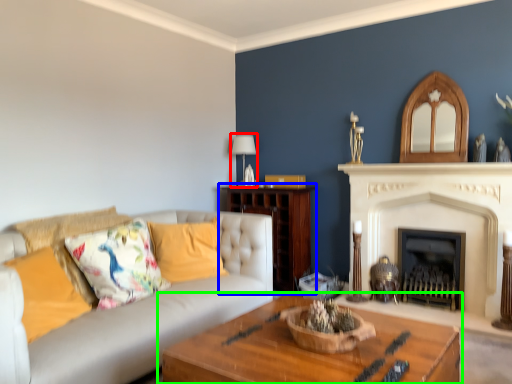
Question: Which is nearer to the lamp (highlighted by a red box)? hardwood (highlighted by a blue box) or table (highlighted by a green box).

Choices:
 (A) hardwood
 (B) table

Answer: (A)